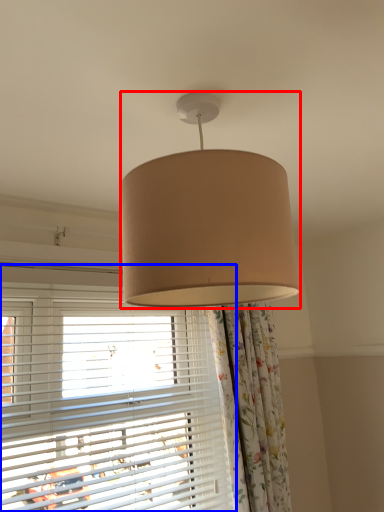
Question: Among these objects, which one is farthest to the camera, lamp (highlighted by a red box) or window (highlighted by a blue box)?

Choices:
 (A) lamp
 (B) window

Answer: (B)